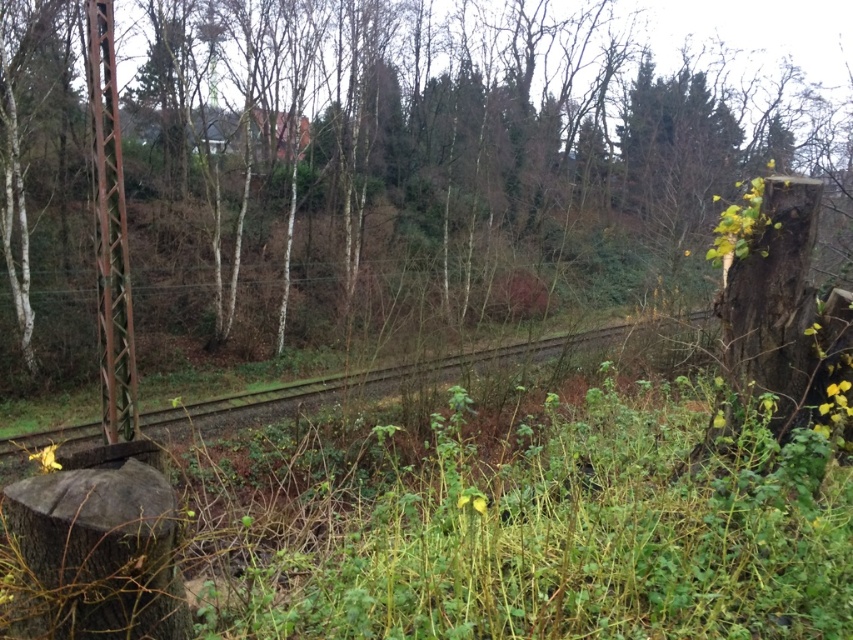
Is smooth bark tree stump at left smaller than brown gravel train track at center?

No.

Who is more distant from viewer, (x=833, y=225) or (x=241, y=403)?

The point (x=241, y=403) is more distant.

Where is `smooth bark tree stump at left`? This screenshot has height=640, width=853. smooth bark tree stump at left is located at coordinates (364, 168).

In order to click on smooth bark tree stump at left in this screenshot , I will do `click(364, 168)`.

Does smooth bark tree stump at left have a greater height compared to brown textured pole at left?

Yes, smooth bark tree stump at left is taller than brown textured pole at left.

At what (x,y) coordinates should I click in order to perform the action: click on smooth bark tree stump at left. Please return your answer as a coordinate pair (x, y). Image resolution: width=853 pixels, height=640 pixels. Looking at the image, I should click on (364, 168).

Identify the location of smooth bark tree stump at left. (364, 168).

Which is more to the left, brown textured pole at left or brown gravel train track at center?

From the viewer's perspective, brown textured pole at left appears more on the left side.

In the scene shown: Which of these two, brown textured pole at left or brown gravel train track at center, stands taller?

Standing taller between the two is brown textured pole at left.

Is point (105, 310) in front of point (148, 422)?

Yes, point (105, 310) is in front of point (148, 422).

Identify the location of brown textured pole at left. The height and width of the screenshot is (640, 853). (109, 230).